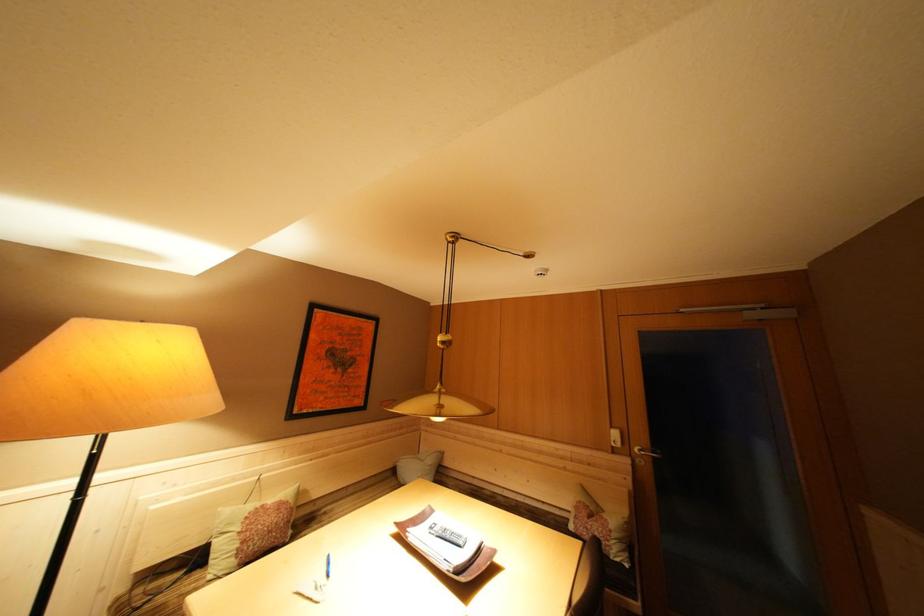
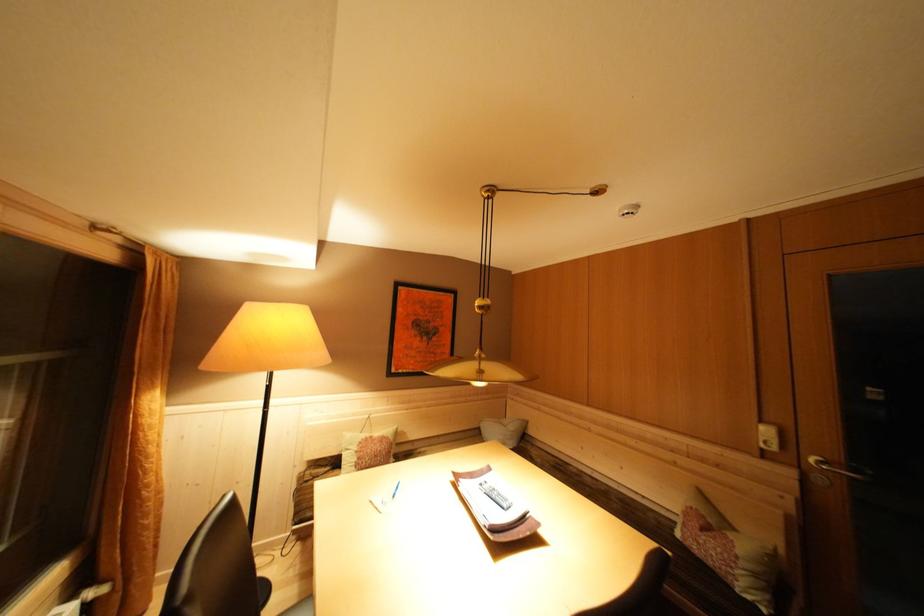
Where in the second image is the point corresponding to (618,432) from the first image?

(768, 427)